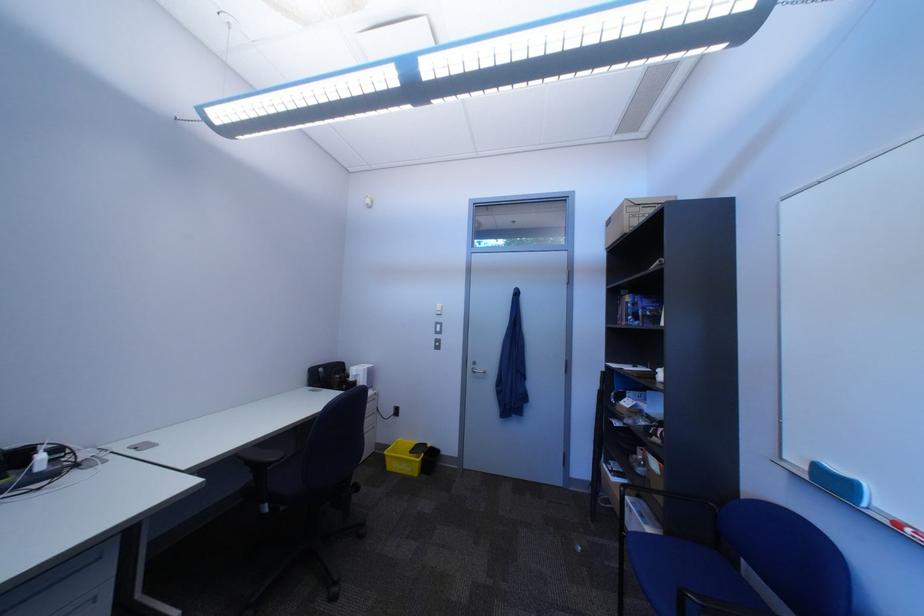
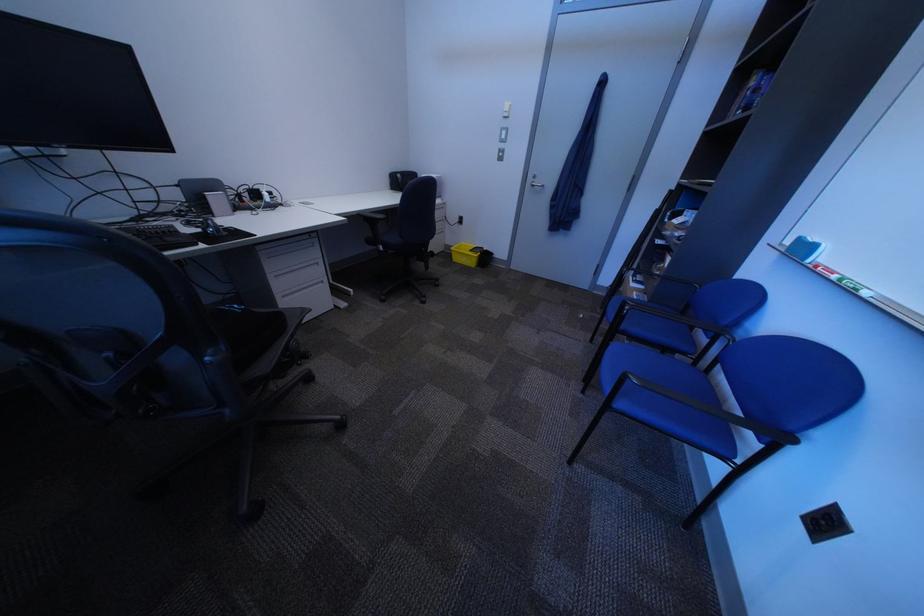
In the second image, find the point that corresponds to the point at 598,553 in the first image.

(599, 318)